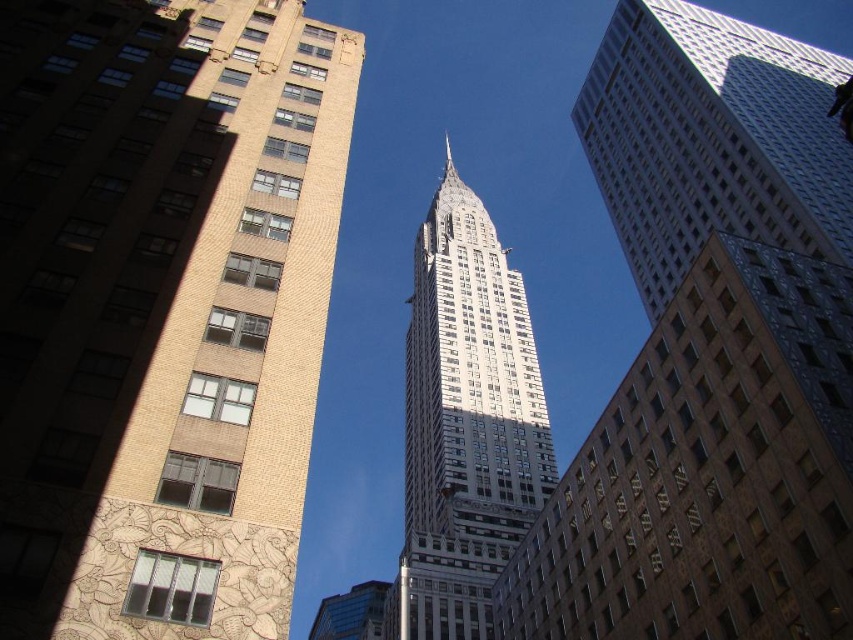
Where is `yellow brick building at left`? This screenshot has height=640, width=853. yellow brick building at left is located at coordinates (161, 308).

Does yellow brick building at left appear over white glass skyscraper at center?

Incorrect, yellow brick building at left is not positioned above white glass skyscraper at center.

Is point (213, 20) positioned before point (589, 131)?

Yes, it is in front of point (589, 131).

In order to click on yellow brick building at left in this screenshot , I will do point(161,308).

Can you confirm if yellow brick building at left is positioned below white glass tower at center?

Actually, yellow brick building at left is above white glass tower at center.

Can you confirm if yellow brick building at left is positioned to the right of white glass tower at center?

Incorrect, yellow brick building at left is not on the right side of white glass tower at center.

Between point (228, 170) and point (437, 612), which one is positioned behind?

The point (437, 612) is behind.

At what (x,y) coordinates should I click in order to perform the action: click on yellow brick building at left. Please return your answer as a coordinate pair (x, y). This screenshot has height=640, width=853. Looking at the image, I should click on (161, 308).

Which is above, white glass skyscraper at center or blue glass building at center?

Positioned higher is white glass skyscraper at center.

Who is lower down, white glass skyscraper at center or blue glass building at center?

blue glass building at center is below.

Does point (669, 120) come farther from viewer compared to point (376, 588)?

No.

This screenshot has width=853, height=640. I want to click on white glass skyscraper at center, so click(712, 140).